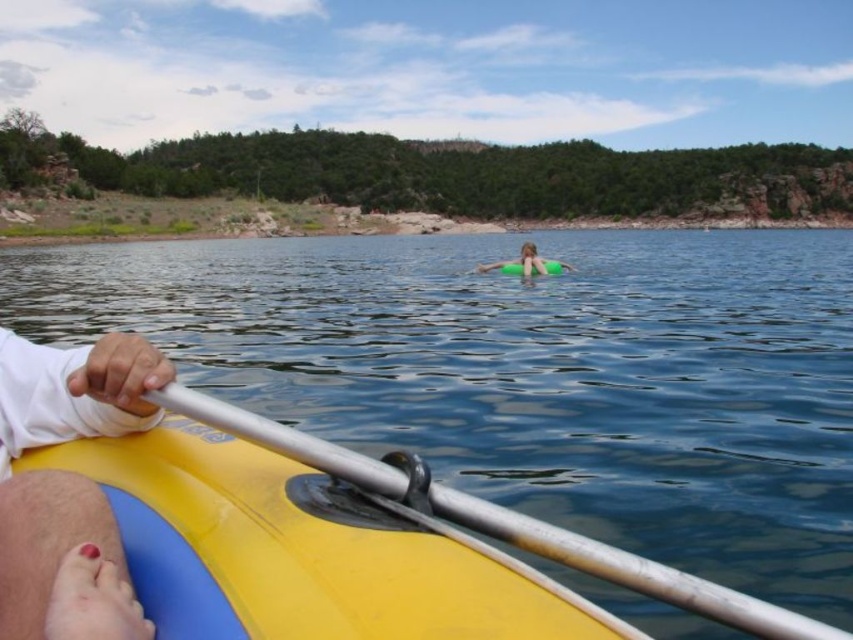
You are standing at the camera position and want to pick up the silver metallic paddle at lower left. Is the paddle within your reach?

The silver metallic paddle at lower left is 4.92 meters away from the camera, so it is out of reach if you are standing at the camera position.

In the scene shown: You are a photographer trying to capture the kayaker and the paddles. Since both white matte paddle at lower left and silver metallic paddle at lower left are in the frame, which one is located more to the left?

The white matte paddle at lower left is positioned on the left side of silver metallic paddle at lower left, so it is more to the left.

You are planning to row a boat and need to choose between the white matte paddle at lower left and the silver metallic paddle at lower left. Which paddle should you choose if you want the larger one?

The silver metallic paddle at lower left is larger than the white matte paddle at lower left, so you should choose the silver metallic paddle at lower left.